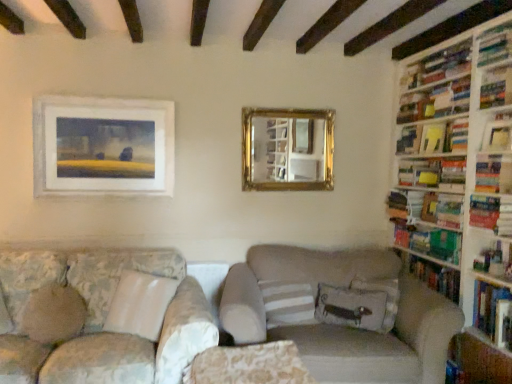
The height and width of the screenshot is (384, 512). Identify the location of wooden bookshelf at right, which ranks as the second shelf in bottom-to-top order. (498, 132).

At what (x,y) coordinates should I click in order to perform the action: click on yellow paper at upper right, which appears as the 4th book when viewed from the top. Please return your answer as a coordinate pair (x, y). The width and height of the screenshot is (512, 384). Looking at the image, I should click on (434, 138).

How much space does white matte painting at upper left, which ranks as the first picture frame in front-to-back order, occupy horizontally?

2.82 inches.

What do you see at coordinates (102, 146) in the screenshot?
I see `white matte painting at upper left, which ranks as the first picture frame in front-to-back order` at bounding box center [102, 146].

At what (x,y) coordinates should I click in order to perform the action: click on wooden bookshelf at right, which ranks as the second shelf in bottom-to-top order. Please return your answer as a coordinate pair (x, y). This screenshot has height=384, width=512. Looking at the image, I should click on (498, 132).

Would you say beige fabric couch at center, acting as the second studio couch starting from the left, is inside or outside hardcover book at right, the sixth book positioned from the top?

beige fabric couch at center, acting as the second studio couch starting from the left, is not enclosed by hardcover book at right, the sixth book positioned from the top.

Can you confirm if beige fabric couch at center, acting as the 1th studio couch starting from the right, is smaller than hardcover book at right, the sixth book positioned from the top?

No.

From a real-world perspective, relative to hardcover book at right, the fourth book ordered from the bottom, is beige fabric couch at center, acting as the 1th studio couch starting from the right, vertically above or below?

beige fabric couch at center, acting as the 1th studio couch starting from the right, is below hardcover book at right, the fourth book ordered from the bottom.

Locate an element on the screen. The width and height of the screenshot is (512, 384). the 1st studio couch in front of the hardcover book at right, the fourth book ordered from the bottom, counting from the anchor's position is located at coordinates (341, 314).

Are hardcover book at upper right, the 2th book from the top, and yellow paper at upper right, which is counted as the 5th book, starting from the top, making contact?

hardcover book at upper right, the 2th book from the top, and yellow paper at upper right, which is counted as the 5th book, starting from the top, are clearly separated.

From a real-world perspective, who is located higher, hardcover book at upper right, the 2th book from the top, or yellow paper at upper right, the fifth book from the bottom?

From a 3D spatial view, hardcover book at upper right, the 2th book from the top, is above.

How many degrees apart are the facing directions of hardcover book at upper right, the eighth book when ordered from bottom to top, and yellow paper at upper right, which is counted as the 5th book, starting from the top?

The angular difference between hardcover book at upper right, the eighth book when ordered from bottom to top, and yellow paper at upper right, which is counted as the 5th book, starting from the top, is 28.4 degrees.

Can you confirm if hardcover book at upper right, the eighth book when ordered from bottom to top, is shorter than yellow paper at upper right, the fifth book from the bottom?

Yes.

Could you tell me if hardcover book at right, which is the first book from bottom to top, is turned towards gold metallic picture frame at upper center, which appears as the first picture frame when viewed from the right?

No, hardcover book at right, which is the first book from bottom to top, is not oriented towards gold metallic picture frame at upper center, which appears as the first picture frame when viewed from the right.

Can you confirm if hardcover book at right, the ninth book viewed from the top, is shorter than gold metallic picture frame at upper center, the 2th picture frame viewed from the left?

Correct, hardcover book at right, the ninth book viewed from the top, is not as tall as gold metallic picture frame at upper center, the 2th picture frame viewed from the left.

Does hardcover book at right, which is the first book from bottom to top, lie behind gold metallic picture frame at upper center, which is counted as the first picture frame, starting from the back?

No.

Which object is positioned more to the left, gold metallic picture frame at upper center, which appears as the first picture frame when viewed from the right, or hardcover book at upper right, the seventh book from the bottom?

gold metallic picture frame at upper center, which appears as the first picture frame when viewed from the right.

Is gold metallic picture frame at upper center, which is counted as the first picture frame, starting from the back, oriented towards hardcover book at upper right, which appears as the third book when viewed from the top?

No, gold metallic picture frame at upper center, which is counted as the first picture frame, starting from the back, is not oriented towards hardcover book at upper right, which appears as the third book when viewed from the top.

From a real-world perspective, is gold metallic picture frame at upper center, which appears as the first picture frame when viewed from the right, above or below hardcover book at upper right, which appears as the third book when viewed from the top?

Clearly, from a real-world perspective, gold metallic picture frame at upper center, which appears as the first picture frame when viewed from the right, is below hardcover book at upper right, which appears as the third book when viewed from the top.

Considering the sizes of objects gold metallic picture frame at upper center, which is counted as the first picture frame, starting from the back, and hardcover book at upper right, which appears as the third book when viewed from the top, in the image provided, who is bigger, gold metallic picture frame at upper center, which is counted as the first picture frame, starting from the back, or hardcover book at upper right, which appears as the third book when viewed from the top,?

Bigger between the two is gold metallic picture frame at upper center, which is counted as the first picture frame, starting from the back.

Considering the sizes of objects brown fabric pillow at left, which is the 3th pillow in right-to-left order, and floral fabric couch at lower left, which is the 1th studio couch in left-to-right order, in the image provided, who is thinner, brown fabric pillow at left, which is the 3th pillow in right-to-left order, or floral fabric couch at lower left, which is the 1th studio couch in left-to-right order,?

brown fabric pillow at left, which is the 3th pillow in right-to-left order, is thinner.

Does brown fabric pillow at left, which is the first pillow in left-to-right order, touch floral fabric couch at lower left, the second studio couch when ordered from right to left?

No, brown fabric pillow at left, which is the first pillow in left-to-right order, is not touching floral fabric couch at lower left, the second studio couch when ordered from right to left.

Can you tell me how much brown fabric pillow at left, which is the 3th pillow in right-to-left order, and floral fabric couch at lower left, the second studio couch when ordered from right to left, differ in facing direction?

There is a 2.8-degree angle between the facing directions of brown fabric pillow at left, which is the 3th pillow in right-to-left order, and floral fabric couch at lower left, the second studio couch when ordered from right to left.

Between brown fabric pillow at left, which is the 3th pillow in right-to-left order, and floral fabric couch at lower left, the second studio couch when ordered from right to left, which one appears on the right side from the viewer's perspective?

From the viewer's perspective, floral fabric couch at lower left, the second studio couch when ordered from right to left, appears more on the right side.

Between green matte bookshelf at right, the 2th book positioned from the bottom, and yellow paper at upper right, which appears as the 4th book when viewed from the top, which one appears on the left side from the viewer's perspective?

Positioned to the left is green matte bookshelf at right, the 2th book positioned from the bottom.

Which object is thinner, green matte bookshelf at right, the 2th book positioned from the bottom, or yellow paper at upper right, which appears as the 4th book when viewed from the top?

yellow paper at upper right, which appears as the 4th book when viewed from the top, is thinner.

Which of these two, green matte bookshelf at right, the 2th book positioned from the bottom, or yellow paper at upper right, which is counted as the 6th book, starting from the bottom, stands taller?

green matte bookshelf at right, the 2th book positioned from the bottom.

Between green matte bookshelf at right, the 2th book positioned from the bottom, and yellow paper at upper right, which appears as the 4th book when viewed from the top, which one has larger size?

Bigger between the two is green matte bookshelf at right, the 2th book positioned from the bottom.

Considering their positions, is green matte bookshelf at right, positioned as the 8th book in top-to-bottom order, located in front of or behind white striped pillow at center, which is the second pillow from left to right?

In the image, green matte bookshelf at right, positioned as the 8th book in top-to-bottom order, appears behind white striped pillow at center, which is the second pillow from left to right.

Would you say green matte bookshelf at right, the 2th book positioned from the bottom, is outside white striped pillow at center, which is counted as the 2th pillow, starting from the right?

green matte bookshelf at right, the 2th book positioned from the bottom, lies outside white striped pillow at center, which is counted as the 2th pillow, starting from the right,'s area.

From the picture: From a real-world perspective, between green matte bookshelf at right, positioned as the 8th book in top-to-bottom order, and white striped pillow at center, which is counted as the 2th pillow, starting from the right, who is vertically lower?

white striped pillow at center, which is counted as the 2th pillow, starting from the right.

From the hardcover book at right, the sixth book positioned from the top, count the 1st studio couch to the left and point to it. Please provide its 2D coordinates.

[(341, 314)]

Locate an element on the screen. the 3rd book located above the yellow paper at upper right, the fifth book from the bottom (from a real-world perspective) is located at coordinates (435, 101).

Based on their spatial positions, is hardcover book at upper right, the eighth book when ordered from bottom to top, or beige fabric couch at center, acting as the 1th studio couch starting from the right, closer to velvet floral pillow at center, which ranks as the third pillow in left-to-right order?

beige fabric couch at center, acting as the 1th studio couch starting from the right.

Looking at the image, which one is located closer to white wooden bookshelf at right, the third shelf in the top-to-bottom sequence, gold metallic picture frame at upper center, the 2th picture frame positioned from the front, or floral fabric couch at lower left, which is the 1th studio couch in left-to-right order?

Among the two, gold metallic picture frame at upper center, the 2th picture frame positioned from the front, is located nearer to white wooden bookshelf at right, the third shelf in the top-to-bottom sequence.

Estimate the real-world distances between objects in this image. Which object is closer to beige fabric couch at center, acting as the second studio couch starting from the left, white matte painting at upper left, the 1th picture frame viewed from the left, or hardcover book at upper right, the seventh book from the bottom?

hardcover book at upper right, the seventh book from the bottom, lies closer to beige fabric couch at center, acting as the second studio couch starting from the left, than the other object.

Which object lies further to the anchor point white striped pillow at center, which is counted as the 2th pillow, starting from the right, white wooden bookshelf at right, the third shelf in the top-to-bottom sequence, or hardcover book at upper right, positioned as the 1th book in top-to-bottom order?

hardcover book at upper right, positioned as the 1th book in top-to-bottom order, is further to white striped pillow at center, which is counted as the 2th pillow, starting from the right.

When comparing their distances from hardcover book at right, which is the first book from bottom to top, does white matte painting at upper left, which appears as the second picture frame when viewed from the right, or green matte bookshelf at right, positioned as the 8th book in top-to-bottom order, seem further?

white matte painting at upper left, which appears as the second picture frame when viewed from the right, is positioned further to the anchor hardcover book at right, which is the first book from bottom to top.

Which object lies nearer to the anchor point brown fabric pillow at left, which is the 3th pillow in right-to-left order, beige fabric couch at center, acting as the second studio couch starting from the left, or white wooden bookshelf at right, the third shelf in the top-to-bottom sequence?

The object closer to brown fabric pillow at left, which is the 3th pillow in right-to-left order, is beige fabric couch at center, acting as the second studio couch starting from the left.

Looking at the image, which one is located further to hardcover books at upper right, positioned as the 1th shelf in top-to-bottom order, hardcover book at upper right, positioned as the 1th book in top-to-bottom order, or beige fabric couch at center, acting as the second studio couch starting from the left?

beige fabric couch at center, acting as the second studio couch starting from the left, is further to hardcover books at upper right, positioned as the 1th shelf in top-to-bottom order.

From the image, which object appears to be nearer to hardcover book at right, the fourth book ordered from the bottom, green matte bookshelf at right, positioned as the 8th book in top-to-bottom order, or velvet floral pillow at center, which ranks as the third pillow in left-to-right order?

green matte bookshelf at right, positioned as the 8th book in top-to-bottom order.

Image resolution: width=512 pixels, height=384 pixels. What are the coordinates of `studio couch located between floral fabric couch at lower left, the second studio couch when ordered from right to left, and velvet floral pillow at center, the first pillow from the right, in the left-right direction` in the screenshot? It's located at (341, 314).

Locate an element on the screen. studio couch between white striped pillow at center, which is the second pillow from left to right, and hardcover book at right, the ninth book viewed from the top, in the horizontal direction is located at coordinates (341, 314).

Where is `shelf located between wooden bookshelf at right, marked as the second shelf in a top-to-bottom arrangement, and hardcover book at upper right, which appears as the third book when viewed from the top, in the depth direction`? The width and height of the screenshot is (512, 384). shelf located between wooden bookshelf at right, marked as the second shelf in a top-to-bottom arrangement, and hardcover book at upper right, which appears as the third book when viewed from the top, in the depth direction is located at coordinates (496, 87).

The image size is (512, 384). In order to click on studio couch located between white matte painting at upper left, which appears as the second picture frame when viewed from the right, and white striped pillow at center, which is counted as the 2th pillow, starting from the right, in the left-right direction in this screenshot , I will do `click(120, 324)`.